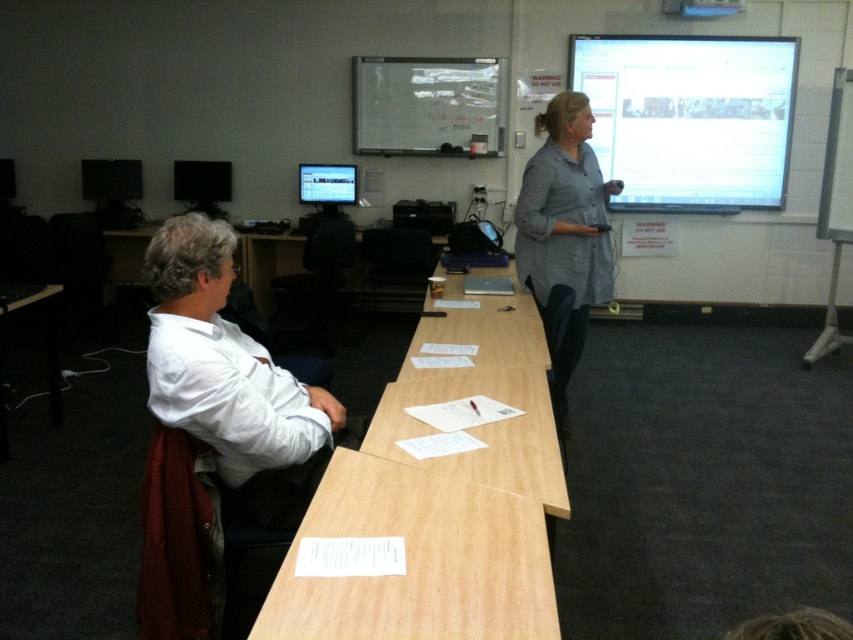
Which is more to the right, light brown wood table at lower center or light brown wood table at center?

From the viewer's perspective, light brown wood table at center appears more on the right side.

Does light brown wood table at lower center have a larger size compared to light brown wood table at center?

Incorrect, light brown wood table at lower center is not larger than light brown wood table at center.

Find the location of a particular element. The height and width of the screenshot is (640, 853). light brown wood table at lower center is located at coordinates (419, 560).

Looking at this image, can you confirm if gray cotton shirt at center is positioned above blue plastic projector at upper center?

Incorrect, gray cotton shirt at center is not positioned above blue plastic projector at upper center.

Is gray cotton shirt at center smaller than blue plastic projector at upper center?

Actually, gray cotton shirt at center might be larger than blue plastic projector at upper center.

Which is behind, point (587, 316) or point (712, 8)?

The point (712, 8) is behind.

This screenshot has height=640, width=853. In order to click on gray cotton shirt at center in this screenshot , I will do `click(566, 227)`.

Who is lower down, white matte shirt at left or blue plastic projector at upper center?

white matte shirt at left

Is point (207, 333) more distant than point (672, 12)?

No, it is not.

What do you see at coordinates (231, 380) in the screenshot? The width and height of the screenshot is (853, 640). I see `white matte shirt at left` at bounding box center [231, 380].

Where is `white matte shirt at left`? The width and height of the screenshot is (853, 640). white matte shirt at left is located at coordinates (231, 380).